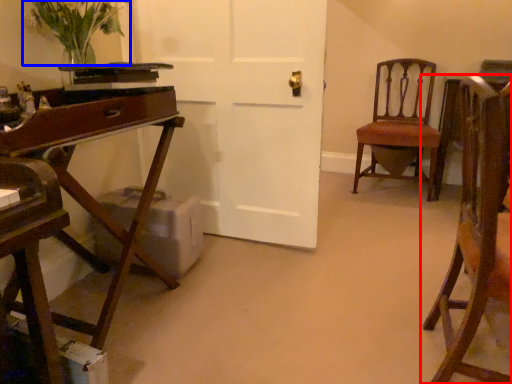
Question: Which object is closer to the camera taking this photo, chair (highlighted by a red box) or floral arrangement (highlighted by a blue box)?

Choices:
 (A) chair
 (B) floral arrangement

Answer: (A)